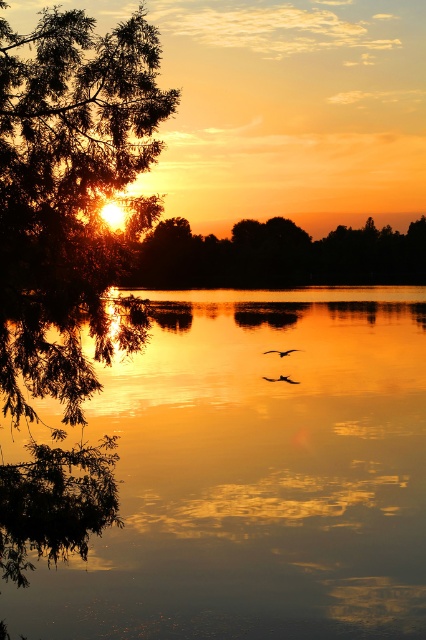
You are standing on the shore of the lake and want to take a photo of both the green leafy tree at left and the green leafy tree at center. Which tree will appear narrower in the photo?

The green leafy tree at left will appear narrower in the photo because it has a lesser width compared to the green leafy tree at center.